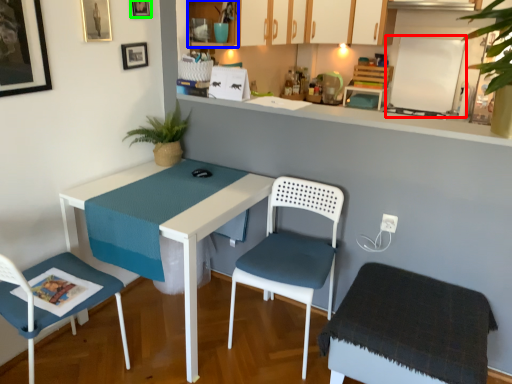
Question: Considering the real-world distances, which object is farthest from bulletin board (highlighted by a red box)? cabinetry (highlighted by a blue box) or picture frame (highlighted by a green box)?

Choices:
 (A) cabinetry
 (B) picture frame

Answer: (B)